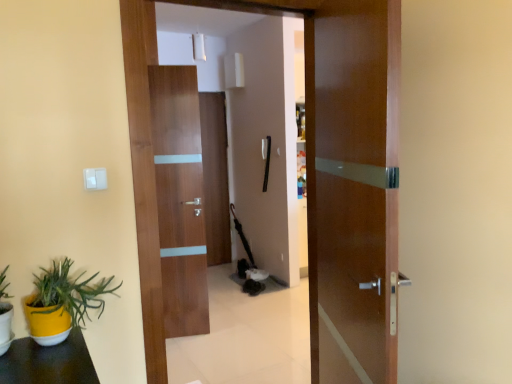
Question: Is point (8, 327) closer or farther from the camera than point (197, 102)?

Choices:
 (A) farther
 (B) closer

Answer: (B)

Question: Based on their sizes in the image, would you say yellow matte flowerpot at lower left is bigger or smaller than walnut wood door at center, which appears as the 2th door when viewed from the back?

Choices:
 (A) big
 (B) small

Answer: (B)

Question: Which is farther from the yellow matte pot at lower left?

Choices:
 (A) wooden door at center, the 2th door in the front-to-back sequence
 (B) matte wood door at center, which ranks as the first door in back-to-front order
 (C) walnut wood door at center, which appears as the 2th door when viewed from the back
 (D) yellow matte flowerpot at lower left
 (E) glossy wood door at center, which ranks as the 4th door in back-to-front order

Answer: (B)

Question: Which is farther from the glossy wood door at center, arranged as the first door when viewed from the front?

Choices:
 (A) walnut wood door at center, which appears as the 2th door when viewed from the back
 (B) yellow matte flowerpot at lower left
 (C) wooden door at center, which is counted as the third door, starting from the back
 (D) matte wood door at center, positioned as the 4th door in front-to-back order
 (E) yellow matte pot at lower left

Answer: (D)